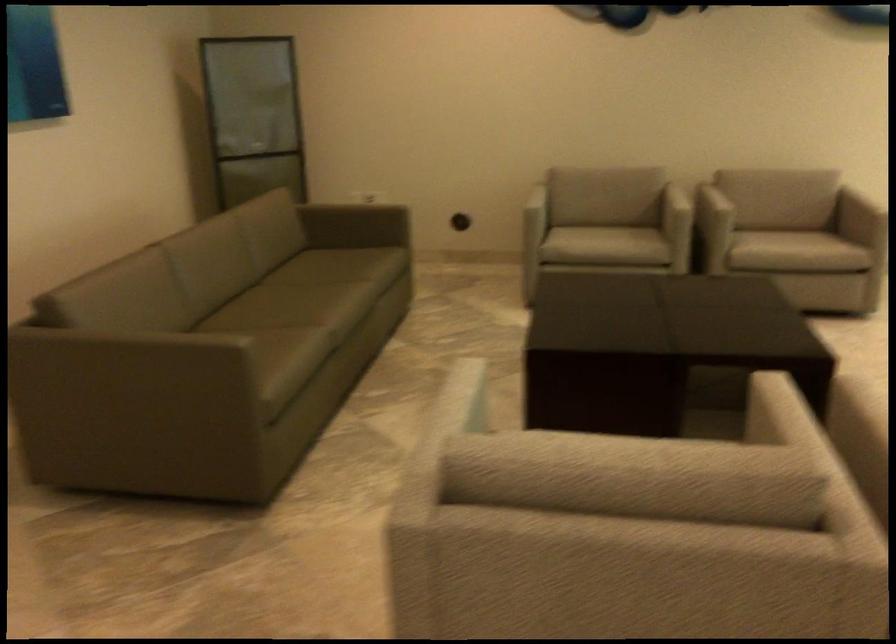
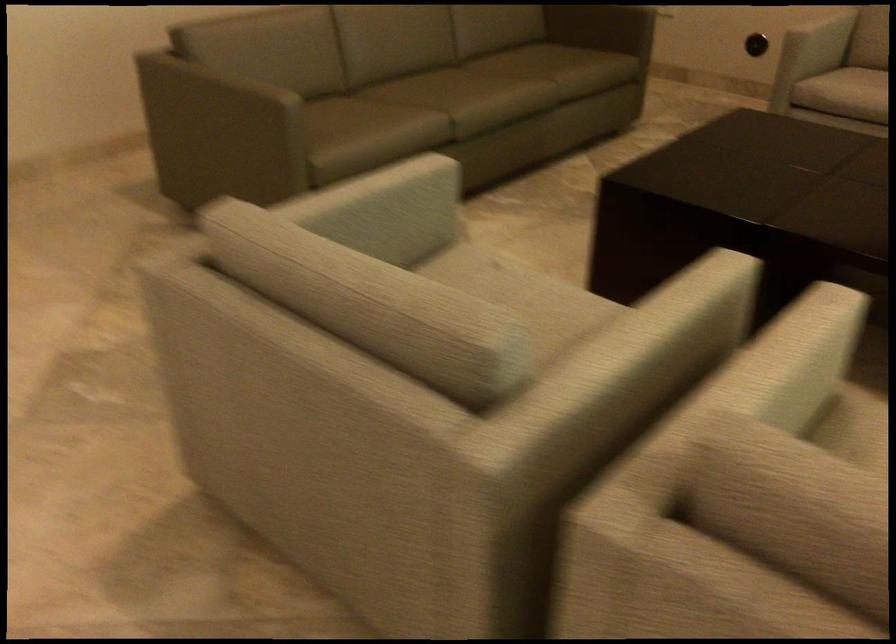
Locate, in the second image, the point that corresponds to point 466,413 in the first image.

(380, 210)